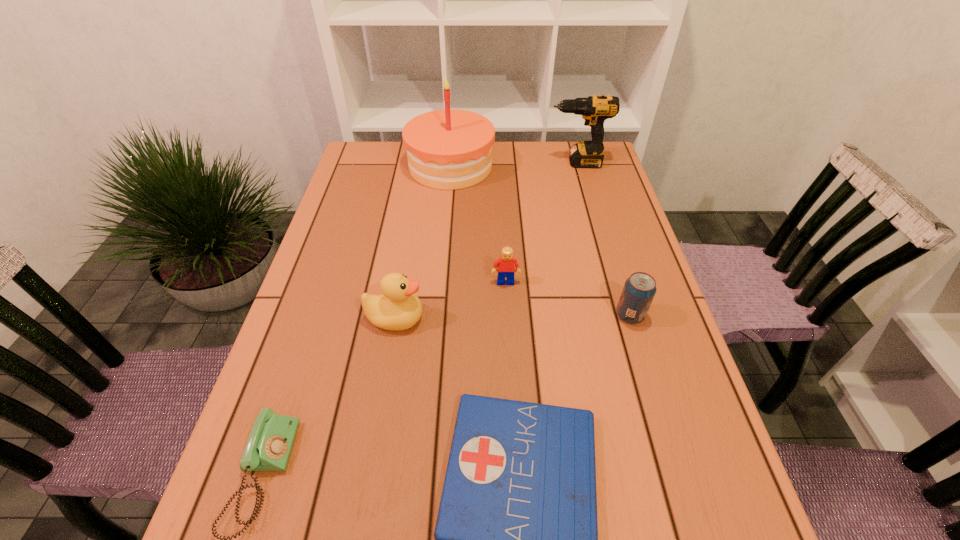
The height and width of the screenshot is (540, 960). Find the location of `the tallest object`. the tallest object is located at coordinates (449, 149).

What are the coordinates of `drill` in the screenshot? It's located at (595, 109).

Image resolution: width=960 pixels, height=540 pixels. What are the coordinates of `duck` in the screenshot? It's located at (398, 308).

The height and width of the screenshot is (540, 960). Identify the location of pop soda. [639, 289].

Locate an element on the screen. The image size is (960, 540). the fifth nearest object is located at coordinates (506, 264).

Locate an element on the screen. The width and height of the screenshot is (960, 540). vacant region located 0.170m on the left of the birthday cake is located at coordinates (355, 166).

Where is `vacant region located at the tip of the drill`? vacant region located at the tip of the drill is located at coordinates (487, 163).

Find the location of a particular element. The height and width of the screenshot is (540, 960). vacant area situated at the tip of the drill is located at coordinates (532, 163).

This screenshot has height=540, width=960. Find the location of `vacant space located 0.240m at the tip of the drill`. vacant space located 0.240m at the tip of the drill is located at coordinates click(x=474, y=163).

Image resolution: width=960 pixels, height=540 pixels. I want to click on vacant point located 0.300m at the beak of the fifth shortest object, so click(557, 318).